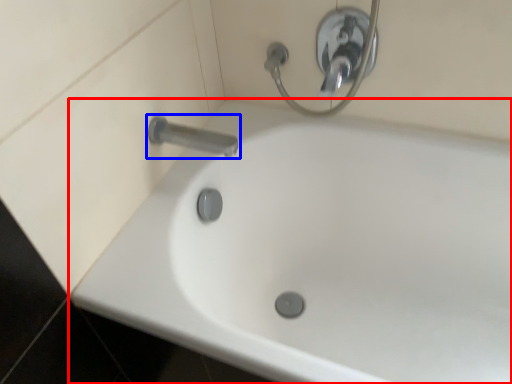
Question: Which object is closer to the camera taking this photo, bathtub (highlighted by a red box) or tap (highlighted by a blue box)?

Choices:
 (A) bathtub
 (B) tap

Answer: (A)